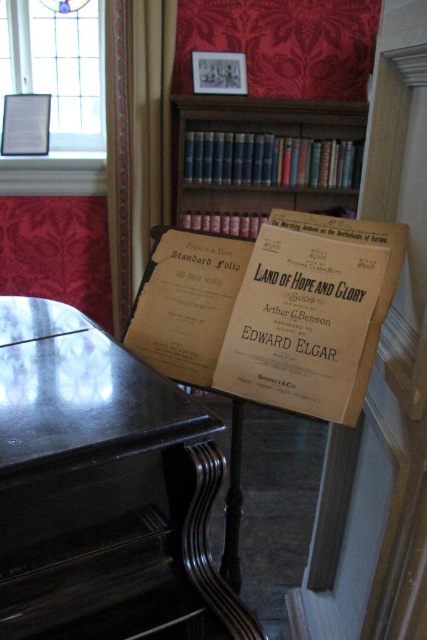
Describe the element at coordinates (85, 481) in the screenshot. I see `black polished piano at center` at that location.

Is black polished piano at center positioned at the back of wooden bookcase at upper center?

No, black polished piano at center is in front of wooden bookcase at upper center.

I want to click on black polished piano at center, so [x=85, y=481].